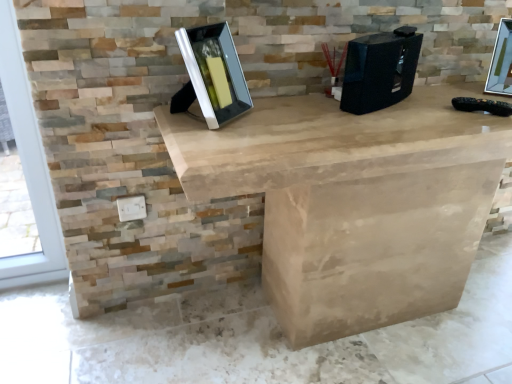
Find the location of a particular element. black plastic desktop computer at center is located at coordinates (380, 70).

The width and height of the screenshot is (512, 384). I want to click on matte black picture frame at center, positioned as the 2th picture frame in back-to-front order, so click(212, 75).

Is metallic silver picture frame at upper right, which is the first picture frame from right to left, shorter than matte black picture frame at center, which ranks as the second picture frame in right-to-left order?

Indeed, metallic silver picture frame at upper right, which is the first picture frame from right to left, has a lesser height compared to matte black picture frame at center, which ranks as the second picture frame in right-to-left order.

From the image's perspective, does metallic silver picture frame at upper right, which is counted as the 2th picture frame, starting from the front, appear higher than matte black picture frame at center, which is counted as the first picture frame, starting from the left?

Correct, metallic silver picture frame at upper right, which is counted as the 2th picture frame, starting from the front, appears higher than matte black picture frame at center, which is counted as the first picture frame, starting from the left, in the image.

Is metallic silver picture frame at upper right, the first picture frame when ordered from back to front, oriented away from matte black picture frame at center, which is the first picture frame from front to back?

No, matte black picture frame at center, which is the first picture frame from front to back, is not at the back of metallic silver picture frame at upper right, the first picture frame when ordered from back to front.

From the image's perspective, which object appears higher, black plastic desktop computer at center or matte black picture frame at center, which ranks as the second picture frame in right-to-left order?

black plastic desktop computer at center.

Considering the relative positions of black plastic desktop computer at center and matte black picture frame at center, which is counted as the first picture frame, starting from the left, in the image provided, is black plastic desktop computer at center to the left or to the right of matte black picture frame at center, which is counted as the first picture frame, starting from the left,?

From the image, it's evident that black plastic desktop computer at center is to the right of matte black picture frame at center, which is counted as the first picture frame, starting from the left.

Is matte black picture frame at center, which is counted as the first picture frame, starting from the left, at the back of black plastic desktop computer at center?

No, black plastic desktop computer at center's orientation is not away from matte black picture frame at center, which is counted as the first picture frame, starting from the left.

Considering the sizes of black plastic desktop computer at center and matte black picture frame at center, which is the first picture frame from front to back, in the image, is black plastic desktop computer at center bigger or smaller than matte black picture frame at center, which is the first picture frame from front to back,?

Clearly, black plastic desktop computer at center is smaller in size than matte black picture frame at center, which is the first picture frame from front to back.

Find the location of a particular element. picture frame above the matte black picture frame at center, positioned as the 2th picture frame in back-to-front order (from the image's perspective) is located at coordinates (501, 61).

Looking at this image, between matte black picture frame at center, which ranks as the second picture frame in right-to-left order, and metallic silver picture frame at upper right, which is the first picture frame from right to left, which one appears on the right side from the viewer's perspective?

metallic silver picture frame at upper right, which is the first picture frame from right to left.

Considering the relative sizes of matte black picture frame at center, which is the first picture frame from front to back, and metallic silver picture frame at upper right, which is the first picture frame from right to left, in the image provided, is matte black picture frame at center, which is the first picture frame from front to back, wider than metallic silver picture frame at upper right, which is the first picture frame from right to left,?

Yes, matte black picture frame at center, which is the first picture frame from front to back, is wider than metallic silver picture frame at upper right, which is the first picture frame from right to left.

Based on the photo, is metallic silver picture frame at upper right, the first picture frame when ordered from back to front, shorter than black plastic desktop computer at center?

No.

From a real-world perspective, between metallic silver picture frame at upper right, the first picture frame when ordered from back to front, and black plastic desktop computer at center, who is vertically lower?

black plastic desktop computer at center.

From the image's perspective, is metallic silver picture frame at upper right, which is the first picture frame from right to left, positioned above or below black plastic desktop computer at center?

metallic silver picture frame at upper right, which is the first picture frame from right to left, is situated higher than black plastic desktop computer at center in the image.

Is matte black picture frame at center, which is the first picture frame from front to back, smaller than black plastic desktop computer at center?

No.

Which object is further away from the camera, matte black picture frame at center, which ranks as the second picture frame in right-to-left order, or black plastic desktop computer at center?

Positioned behind is black plastic desktop computer at center.

From the image's perspective, which is above, matte black picture frame at center, positioned as the 2th picture frame in back-to-front order, or black plastic desktop computer at center?

black plastic desktop computer at center appears higher in the image.

Is matte black picture frame at center, which is the first picture frame from front to back, positioned with its back to black plastic desktop computer at center?

No.

Based on the photo, would you say black plastic desktop computer at center is outside metallic silver picture frame at upper right, the first picture frame when ordered from back to front?

Indeed, black plastic desktop computer at center is completely outside metallic silver picture frame at upper right, the first picture frame when ordered from back to front.

Does black plastic desktop computer at center turn towards metallic silver picture frame at upper right, which is the first picture frame from right to left?

No, black plastic desktop computer at center does not turn towards metallic silver picture frame at upper right, which is the first picture frame from right to left.

Can you confirm if black plastic desktop computer at center is wider than metallic silver picture frame at upper right, which is counted as the 2th picture frame, starting from the front?

No, black plastic desktop computer at center is not wider than metallic silver picture frame at upper right, which is counted as the 2th picture frame, starting from the front.

Based on the photo, does black plastic desktop computer at center have a larger size compared to metallic silver picture frame at upper right, the first picture frame when ordered from back to front?

Yes.

You are a GUI agent. You are given a task and a screenshot of the screen. Output one action in this format:
    pyautogui.click(x=<x>, y=<y>)
    Task: Click on the picture frame in front of the metallic silver picture frame at upper right, which is the first picture frame from right to left
    
    Given the screenshot: What is the action you would take?
    pyautogui.click(x=212, y=75)

Locate an element on the screen. The height and width of the screenshot is (384, 512). picture frame below the black plastic desktop computer at center (from the image's perspective) is located at coordinates (212, 75).

When comparing their distances from metallic silver picture frame at upper right, the 2th picture frame viewed from the left, does matte black picture frame at center, positioned as the 2th picture frame in back-to-front order, or black plastic desktop computer at center seem further?

matte black picture frame at center, positioned as the 2th picture frame in back-to-front order, lies further to metallic silver picture frame at upper right, the 2th picture frame viewed from the left, than the other object.

When comparing their distances from matte black picture frame at center, positioned as the 2th picture frame in back-to-front order, does black plastic desktop computer at center or metallic silver picture frame at upper right, which is counted as the 2th picture frame, starting from the front, seem further?

metallic silver picture frame at upper right, which is counted as the 2th picture frame, starting from the front, is positioned further to the anchor matte black picture frame at center, positioned as the 2th picture frame in back-to-front order.

Which object lies nearer to the anchor point black plastic desktop computer at center, metallic silver picture frame at upper right, the 2th picture frame viewed from the left, or matte black picture frame at center, positioned as the 2th picture frame in back-to-front order?

matte black picture frame at center, positioned as the 2th picture frame in back-to-front order, is closer to black plastic desktop computer at center.

When comparing their distances from metallic silver picture frame at upper right, the 2th picture frame viewed from the left, does black plastic desktop computer at center or matte black picture frame at center, which ranks as the second picture frame in right-to-left order, seem closer?

black plastic desktop computer at center is closer to metallic silver picture frame at upper right, the 2th picture frame viewed from the left.

Based on their spatial positions, is metallic silver picture frame at upper right, which is counted as the 2th picture frame, starting from the front, or black plastic desktop computer at center further from matte black picture frame at center, which is counted as the first picture frame, starting from the left?

The object further to matte black picture frame at center, which is counted as the first picture frame, starting from the left, is metallic silver picture frame at upper right, which is counted as the 2th picture frame, starting from the front.

Looking at the image, which one is located further to black plastic desktop computer at center, matte black picture frame at center, which is the first picture frame from front to back, or metallic silver picture frame at upper right, the first picture frame when ordered from back to front?

metallic silver picture frame at upper right, the first picture frame when ordered from back to front, lies further to black plastic desktop computer at center than the other object.

Locate an element on the screen. desktop computer between matte black picture frame at center, which is counted as the first picture frame, starting from the left, and metallic silver picture frame at upper right, the first picture frame when ordered from back to front is located at coordinates (380, 70).